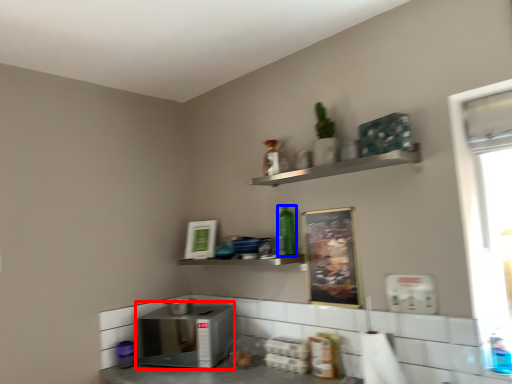
Question: Which object appears farthest to the camera in this image, appliance (highlighted by a red box) or bottle (highlighted by a blue box)?

Choices:
 (A) appliance
 (B) bottle

Answer: (B)